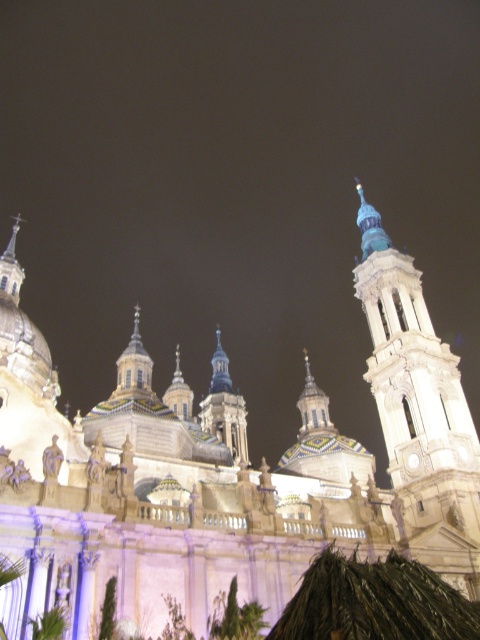
Is white stone church at center below white stone tower at right?

Correct, white stone church at center is located below white stone tower at right.

Which of these two, white stone church at center or white stone tower at right, stands shorter?

white stone church at center

Between point (79, 538) and point (392, 355), which one is positioned behind?

The point (392, 355) is behind.

Image resolution: width=480 pixels, height=640 pixels. I want to click on white stone church at center, so click(228, 470).

Does white stone tower at right have a lesser height compared to blue glass dome at center?

In fact, white stone tower at right may be taller than blue glass dome at center.

Looking at this image, does white stone tower at right appear on the left side of blue glass dome at center?

No, white stone tower at right is not to the left of blue glass dome at center.

Which is behind, point (383, 330) or point (224, 392)?

The point (224, 392) is more distant.

Where is `white stone tower at right`? The image size is (480, 640). white stone tower at right is located at coordinates (419, 410).

Between point (429, 332) and point (223, 419), which one is positioned in front?

Point (429, 332) is more forward.

What do you see at coordinates (228, 470) in the screenshot? I see `white stone church at center` at bounding box center [228, 470].

Does point (84, 435) come behind point (215, 365)?

No.

What are the coordinates of `white stone church at center` in the screenshot? It's located at (228, 470).